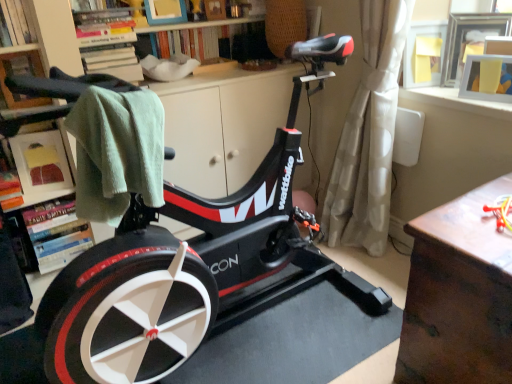
This screenshot has height=384, width=512. What do you see at coordinates (458, 295) in the screenshot?
I see `brown wooden table at right` at bounding box center [458, 295].

Describe the element at coordinates (218, 283) in the screenshot. I see `black matte stationary bicycle at center` at that location.

In the scene shown: What is the approximate height of black matte stationary bicycle at center?

black matte stationary bicycle at center is 4.04 feet in height.

At what (x,y) coordinates should I click in order to perform the action: click on wooden bookshelf at upper center, the first shelf in the back-to-front sequence. Please return your answer as a coordinate pair (x, y). This screenshot has width=512, height=384. Looking at the image, I should click on (192, 38).

Find the location of `matte black towel at left, the first shelf from the front`. matte black towel at left, the first shelf from the front is located at coordinates (22, 73).

Where is `beige sheer curtain at right`? beige sheer curtain at right is located at coordinates (368, 135).

Measure the distance between point (327, 221) and camera.

Point (327, 221) is 2.18 meters from camera.

Where is `brown wooden table at right`? The height and width of the screenshot is (384, 512). brown wooden table at right is located at coordinates (458, 295).

Would you say matte white frame at upper left, which is the second shelf from back to front, is part of wooden bookshelf at upper center, the third shelf when ordered from back to front,'s contents?

No, matte white frame at upper left, which is the second shelf from back to front, is not inside wooden bookshelf at upper center, the third shelf when ordered from back to front.

Is wooden bookshelf at upper center, the third shelf when ordered from back to front, thinner than matte white frame at upper left, which is the second shelf from back to front?

In fact, wooden bookshelf at upper center, the third shelf when ordered from back to front, might be wider than matte white frame at upper left, which is the second shelf from back to front.

This screenshot has width=512, height=384. Identify the location of shelf that is the 1st one when counting rightward from the matte white frame at upper left, placed as the 3th shelf when sorted from front to back. (108, 43).

Considering the positions of objects wooden bookshelf at upper center, the third shelf when ordered from back to front, and matte white frame at upper left, which is the second shelf from back to front, in the image provided, who is behind, wooden bookshelf at upper center, the third shelf when ordered from back to front, or matte white frame at upper left, which is the second shelf from back to front,?

matte white frame at upper left, which is the second shelf from back to front, is further away from the camera.

In the scene shown: Would you say brown wooden table at right is a long distance from black matte stationary bicycle at center?

No, brown wooden table at right is in close proximity to black matte stationary bicycle at center.

Can you tell me how much brown wooden table at right and black matte stationary bicycle at center differ in facing direction?

90.1 degrees separate the facing orientations of brown wooden table at right and black matte stationary bicycle at center.

From the image's perspective, who appears lower, brown wooden table at right or black matte stationary bicycle at center?

brown wooden table at right is shown below in the image.

Who is shorter, brown wooden table at right or black matte stationary bicycle at center?

brown wooden table at right is shorter.

What's the angular difference between wooden picture frame at upper right, the first picture frame viewed from the front, and wooden bookshelf at upper center, positioned as the 4th shelf in front-to-back order,'s facing directions?

The angle between the facing direction of wooden picture frame at upper right, the first picture frame viewed from the front, and the facing direction of wooden bookshelf at upper center, positioned as the 4th shelf in front-to-back order, is 66.3 degrees.

Based on the photo, can you confirm if wooden picture frame at upper right, the first picture frame viewed from the front, is wider than wooden bookshelf at upper center, positioned as the 4th shelf in front-to-back order?

No, wooden picture frame at upper right, the first picture frame viewed from the front, is not wider than wooden bookshelf at upper center, positioned as the 4th shelf in front-to-back order.

From a real-world perspective, count 1st shelfs upward from the wooden picture frame at upper right, the first picture frame viewed from the front, and point to it. Please provide its 2D coordinates.

[(192, 38)]

What's the angular difference between beige sheer curtain at right and matte white frame at upper left, which is the second shelf from back to front,'s facing directions?

They differ by 69 degrees in their facing directions.

Does beige sheer curtain at right come in front of matte white frame at upper left, which is the second shelf from back to front?

Yes.

Where is `curtain above the matte white frame at upper left, placed as the 3th shelf when sorted from front to back (from the image's perspective)`? curtain above the matte white frame at upper left, placed as the 3th shelf when sorted from front to back (from the image's perspective) is located at coordinates (368, 135).

Considering the relative sizes of beige sheer curtain at right and matte white frame at upper left, placed as the 3th shelf when sorted from front to back, in the image provided, is beige sheer curtain at right shorter than matte white frame at upper left, placed as the 3th shelf when sorted from front to back,?

In fact, beige sheer curtain at right may be taller than matte white frame at upper left, placed as the 3th shelf when sorted from front to back.

Is beige sheer curtain at right facing towards matte black towel at left, the 4th shelf positioned from the back?

No, beige sheer curtain at right is not aimed at matte black towel at left, the 4th shelf positioned from the back.

Are beige sheer curtain at right and matte black towel at left, the first shelf from the front, far apart?

Yes, beige sheer curtain at right is far from matte black towel at left, the first shelf from the front.

The height and width of the screenshot is (384, 512). Identify the location of curtain on the right of matte black towel at left, the 4th shelf positioned from the back. (368, 135).

From the image's perspective, does beige sheer curtain at right appear higher than matte black towel at left, the first shelf from the front?

No, from the image's perspective, beige sheer curtain at right is not above matte black towel at left, the first shelf from the front.

Is wooden bookshelf at upper center, positioned as the 2th shelf in front-to-back order, inside or outside of brown wooden table at right?

wooden bookshelf at upper center, positioned as the 2th shelf in front-to-back order, is spatially situated outside brown wooden table at right.

Consider the image. Which of these two, wooden bookshelf at upper center, the third shelf when ordered from back to front, or brown wooden table at right, is wider?

Wider between the two is brown wooden table at right.

Locate an element on the screen. The width and height of the screenshot is (512, 384). table in front of the wooden bookshelf at upper center, the third shelf when ordered from back to front is located at coordinates (458, 295).

Who is taller, wooden bookshelf at upper center, the third shelf when ordered from back to front, or brown wooden table at right?

With more height is brown wooden table at right.

Is black matte stationary bicycle at center bigger or smaller than wooden bookshelf at upper center, the third shelf when ordered from back to front?

In the image, black matte stationary bicycle at center appears to be larger than wooden bookshelf at upper center, the third shelf when ordered from back to front.

From the image's perspective, is black matte stationary bicycle at center above or below wooden bookshelf at upper center, positioned as the 2th shelf in front-to-back order?

Based on their image positions, black matte stationary bicycle at center is located beneath wooden bookshelf at upper center, positioned as the 2th shelf in front-to-back order.

Would you say black matte stationary bicycle at center is outside wooden bookshelf at upper center, positioned as the 2th shelf in front-to-back order?

That's correct, black matte stationary bicycle at center is outside of wooden bookshelf at upper center, positioned as the 2th shelf in front-to-back order.

Is the surface of black matte stationary bicycle at center in direct contact with wooden bookshelf at upper center, positioned as the 2th shelf in front-to-back order?

black matte stationary bicycle at center is not next to wooden bookshelf at upper center, positioned as the 2th shelf in front-to-back order, and they're not touching.

From the matte white frame at upper left, which is the second shelf from back to front, count 1st shelfs forward and point to it. Please provide its 2D coordinates.

[(108, 43)]

This screenshot has width=512, height=384. Find the location of `stationary bicycle above the brown wooden table at right (from the image's perspective)`. stationary bicycle above the brown wooden table at right (from the image's perspective) is located at coordinates (218, 283).

Looking at the image, which one is located further to beige sheer curtain at right, wooden bookshelf at upper center, positioned as the 4th shelf in front-to-back order, or matte white frame at upper left, which is the second shelf from back to front?

Based on the image, matte white frame at upper left, which is the second shelf from back to front, appears to be further to beige sheer curtain at right.

Based on their spatial positions, is brown wooden table at right or wooden picture frame at upper right, placed as the 2th picture frame when sorted from front to back, closer to wooden picture frame at upper right, placed as the second picture frame when sorted from back to front?

Among the two, wooden picture frame at upper right, placed as the 2th picture frame when sorted from front to back, is located nearer to wooden picture frame at upper right, placed as the second picture frame when sorted from back to front.

Which object lies nearer to the anchor point wooden picture frame at upper right, placed as the second picture frame when sorted from back to front, black matte stationary bicycle at center or wooden picture frame at upper right, placed as the 2th picture frame when sorted from front to back?

wooden picture frame at upper right, placed as the 2th picture frame when sorted from front to back, lies closer to wooden picture frame at upper right, placed as the second picture frame when sorted from back to front, than the other object.

Based on the photo, considering their positions, is wooden picture frame at upper right, the 1th picture frame from the back, positioned further to wooden bookshelf at upper center, the third shelf when ordered from back to front, than matte black towel at left, the 4th shelf positioned from the back?

wooden picture frame at upper right, the 1th picture frame from the back, lies further to wooden bookshelf at upper center, the third shelf when ordered from back to front, than the other object.

Based on the photo, considering their positions, is brown wooden table at right positioned further to beige sheer curtain at right than matte black towel at left, the first shelf from the front?

Based on the image, matte black towel at left, the first shelf from the front, appears to be further to beige sheer curtain at right.

From the image, which object appears to be nearer to beige sheer curtain at right, matte black towel at left, the 4th shelf positioned from the back, or matte white frame at upper left, placed as the 3th shelf when sorted from front to back?

matte white frame at upper left, placed as the 3th shelf when sorted from front to back.

From the image, which object appears to be farther from brown wooden table at right, wooden picture frame at upper right, the first picture frame viewed from the front, or black matte stationary bicycle at center?

wooden picture frame at upper right, the first picture frame viewed from the front, is further to brown wooden table at right.

Looking at the image, which one is located further to wooden bookshelf at upper center, positioned as the 2th shelf in front-to-back order, beige sheer curtain at right or matte white frame at upper left, which is the second shelf from back to front?

beige sheer curtain at right is positioned further to the anchor wooden bookshelf at upper center, positioned as the 2th shelf in front-to-back order.

Find the location of a particular element. This screenshot has width=512, height=384. curtain between wooden picture frame at upper right, the 1th picture frame from the back, and brown wooden table at right in the up-down direction is located at coordinates (368, 135).

At what (x,y) coordinates should I click in order to perform the action: click on curtain between black matte stationary bicycle at center and wooden picture frame at upper right, the 1th picture frame from the back, in the horizontal direction. Please return your answer as a coordinate pair (x, y). The height and width of the screenshot is (384, 512). Looking at the image, I should click on (368, 135).

Identify the location of stationary bicycle located between wooden bookshelf at upper center, positioned as the 2th shelf in front-to-back order, and brown wooden table at right in the left-right direction. (218, 283).

Identify the location of shelf between wooden bookshelf at upper center, the third shelf when ordered from back to front, and matte white frame at upper left, which is the second shelf from back to front, in the up-down direction. This screenshot has width=512, height=384. (22, 73).